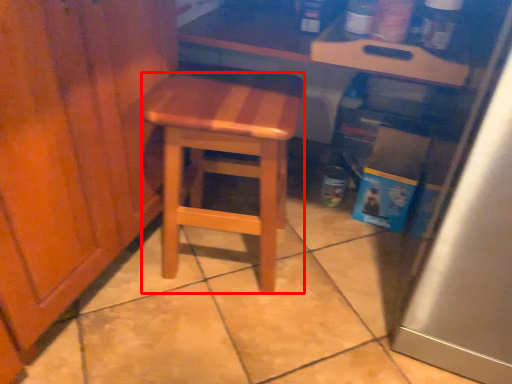
Question: From the image's perspective, where is stool (annotated by the red box) located in relation to counter in the image?

Choices:
 (A) above
 (B) below

Answer: (B)